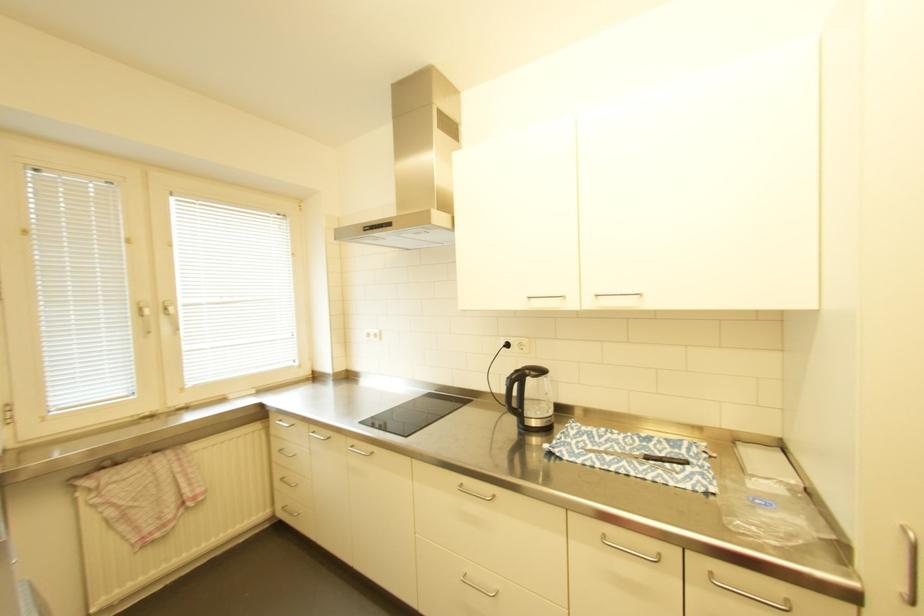
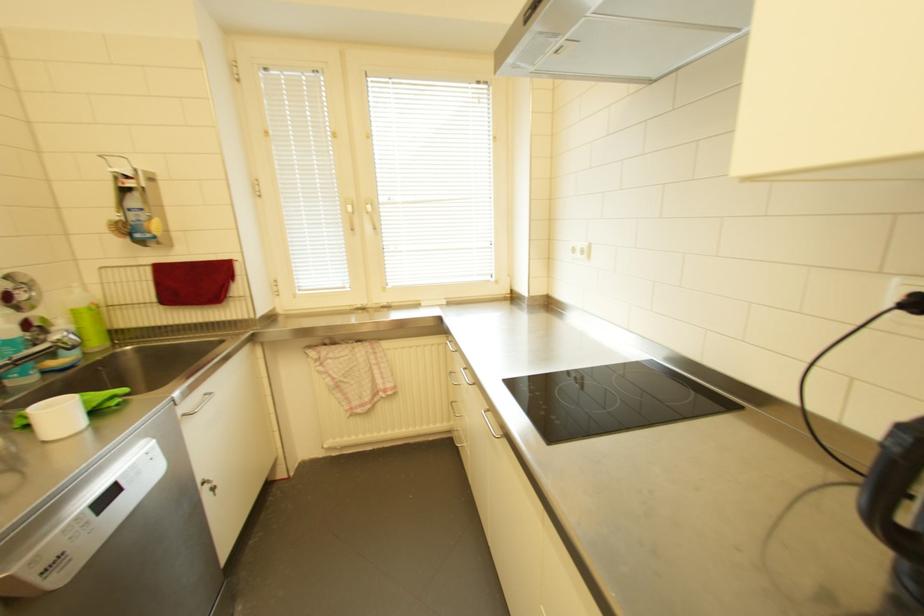
Question: The images are taken continuously from a first-person perspective. In which direction is your viewpoint rotating?

Choices:
 (A) Left
 (B) Right
 (C) Up
 (D) Down

Answer: (A)